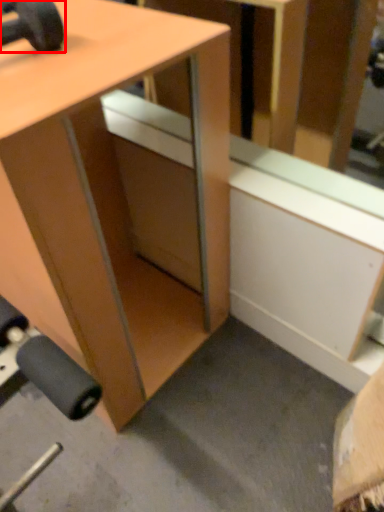
Question: From the image's perspective, what is the correct spatial positioning of dumbbell (annotated by the red box) in reference to desk?

Choices:
 (A) below
 (B) above

Answer: (B)